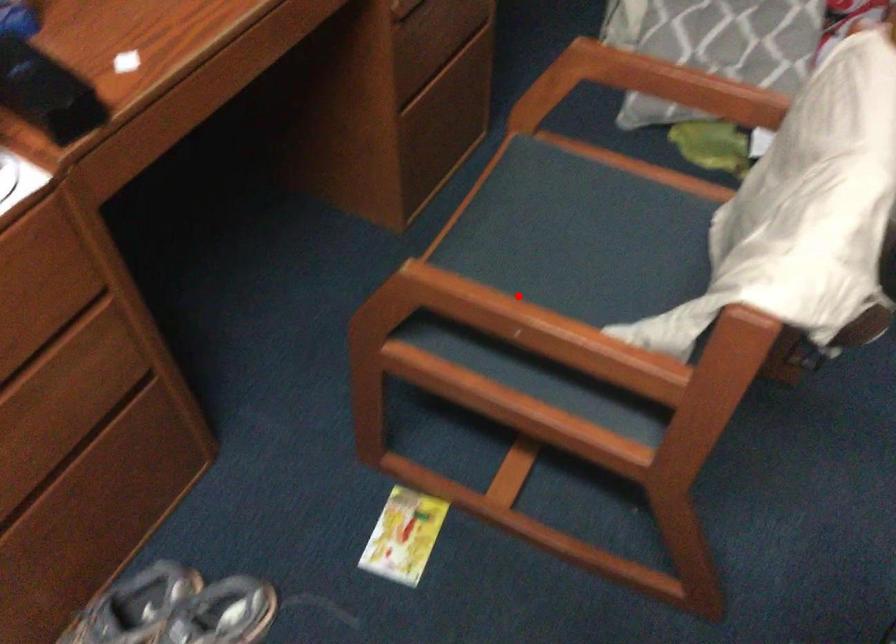
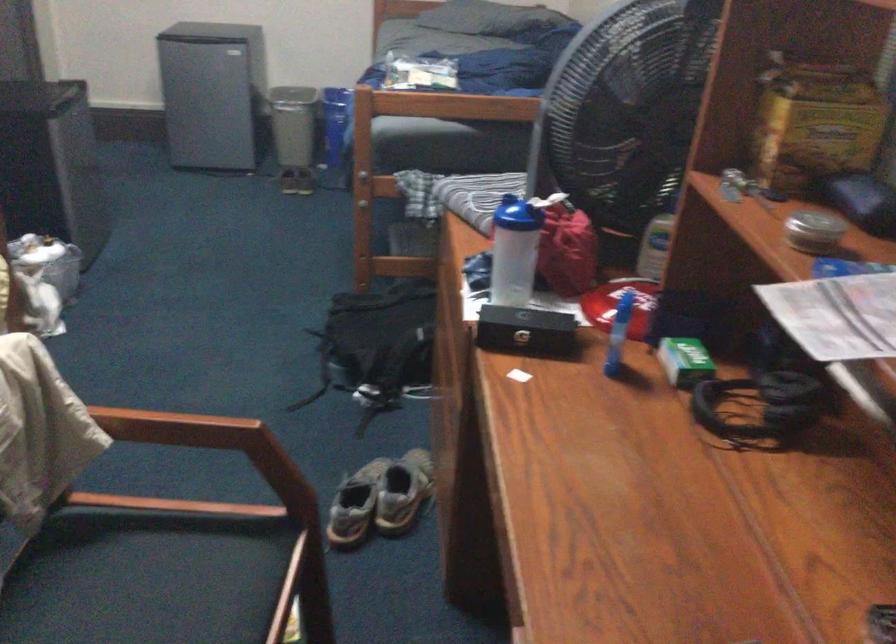
Question: A red point is marked in image1. In image2, is the corresponding 3D point closer to the camera or farther? Reply with the corresponding letter.

Choices:
 (A) The corresponding 3D point is closer.
 (B) The corresponding 3D point is farther.

Answer: (B)